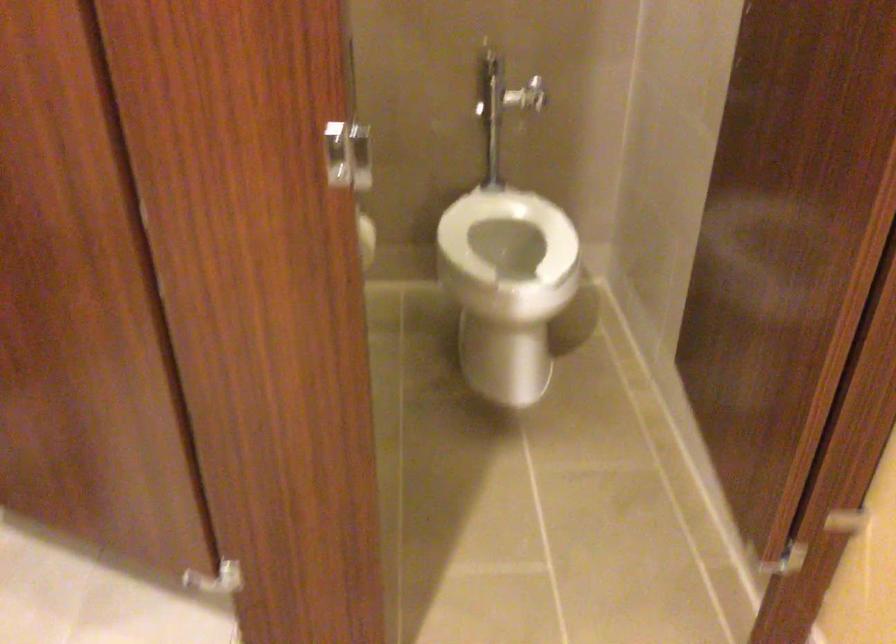
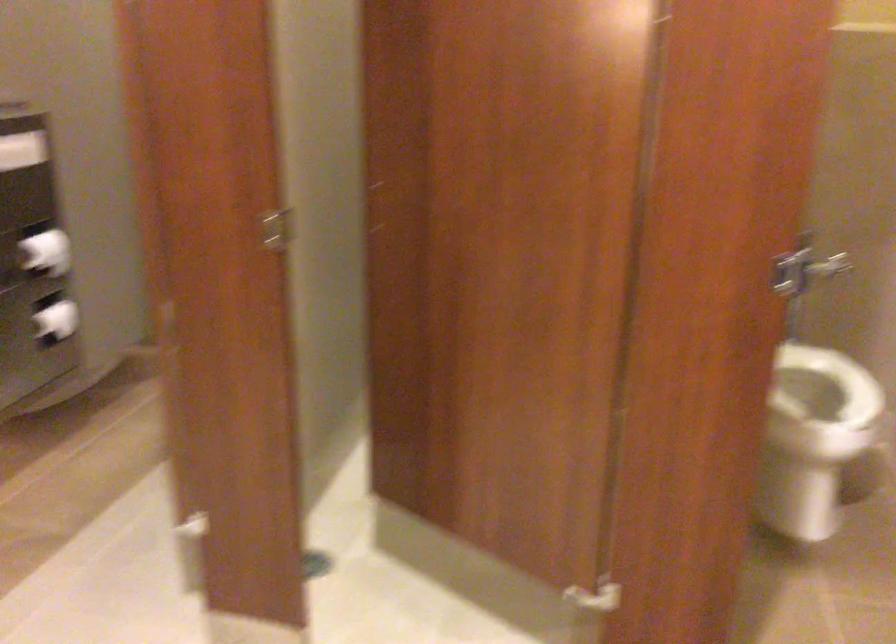
Where in the second image is the point corresponding to point 507,254 from the first image?

(811, 393)